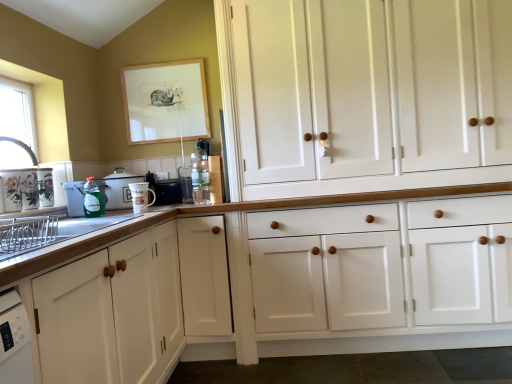
Question: Can you confirm if porcelain floral mugs at left, placed as the 1th appliance when sorted from left to right, is smaller than white glossy cabinet at lower left, which ranks as the 1th cabinetry in left-to-right order?

Choices:
 (A) no
 (B) yes

Answer: (B)

Question: Is porcelain floral mugs at left, the sixth appliance in the right-to-left sequence, bigger than white glossy cabinet at lower left, which ranks as the second cabinetry in right-to-left order?

Choices:
 (A) no
 (B) yes

Answer: (A)

Question: Is porcelain floral mugs at left, the sixth appliance in the right-to-left sequence, located outside white glossy cabinet at lower left, which ranks as the second cabinetry in right-to-left order?

Choices:
 (A) no
 (B) yes

Answer: (B)

Question: Is porcelain floral mugs at left, placed as the 1th appliance when sorted from left to right, with white glossy cabinet at lower left, which ranks as the 1th cabinetry in left-to-right order?

Choices:
 (A) yes
 (B) no

Answer: (B)

Question: From the image's perspective, is porcelain floral mugs at left, the sixth appliance in the right-to-left sequence, on top of white glossy cabinet at lower left, which ranks as the second cabinetry in right-to-left order?

Choices:
 (A) yes
 (B) no

Answer: (A)

Question: Is point (81, 226) positioned closer to the camera than point (186, 195)?

Choices:
 (A) farther
 (B) closer

Answer: (B)

Question: In the image, is satin silver dish rack at left on the left side or the right side of metallic silver toaster at upper center, positioned as the 6th appliance in left-to-right order?

Choices:
 (A) left
 (B) right

Answer: (A)

Question: Considering the positions of satin silver dish rack at left and metallic silver toaster at upper center, positioned as the 6th appliance in left-to-right order, in the image, is satin silver dish rack at left taller or shorter than metallic silver toaster at upper center, positioned as the 6th appliance in left-to-right order,?

Choices:
 (A) short
 (B) tall

Answer: (A)

Question: Considering their positions, is satin silver dish rack at left located in front of or behind metallic silver toaster at upper center, arranged as the first appliance when viewed from the right?

Choices:
 (A) behind
 (B) front

Answer: (B)

Question: In terms of height, does green plastic dish soap at left, acting as the 5th appliance starting from the right, look taller or shorter compared to black plastic toaster at center, the fifth appliance viewed from the left?

Choices:
 (A) tall
 (B) short

Answer: (A)

Question: Considering their positions, is green plastic dish soap at left, acting as the 5th appliance starting from the right, located in front of or behind black plastic toaster at center, the fifth appliance viewed from the left?

Choices:
 (A) behind
 (B) front

Answer: (B)

Question: From the image's perspective, is green plastic dish soap at left, acting as the 5th appliance starting from the right, positioned above or below black plastic toaster at center, the fifth appliance viewed from the left?

Choices:
 (A) below
 (B) above

Answer: (A)

Question: Is green plastic dish soap at left, acting as the 5th appliance starting from the right, wider or thinner than black plastic toaster at center, which is the second appliance in right-to-left order?

Choices:
 (A) wide
 (B) thin

Answer: (A)

Question: Looking at their shapes, would you say white wood cabinets at center, placed as the first cabinetry when sorted from right to left, is wider or thinner than translucent glass bottle at center, positioned as the second bottle in left-to-right order?

Choices:
 (A) wide
 (B) thin

Answer: (A)

Question: Is white wood cabinets at center, placed as the first cabinetry when sorted from right to left, bigger or smaller than translucent glass bottle at center, positioned as the second bottle in left-to-right order?

Choices:
 (A) small
 (B) big

Answer: (B)